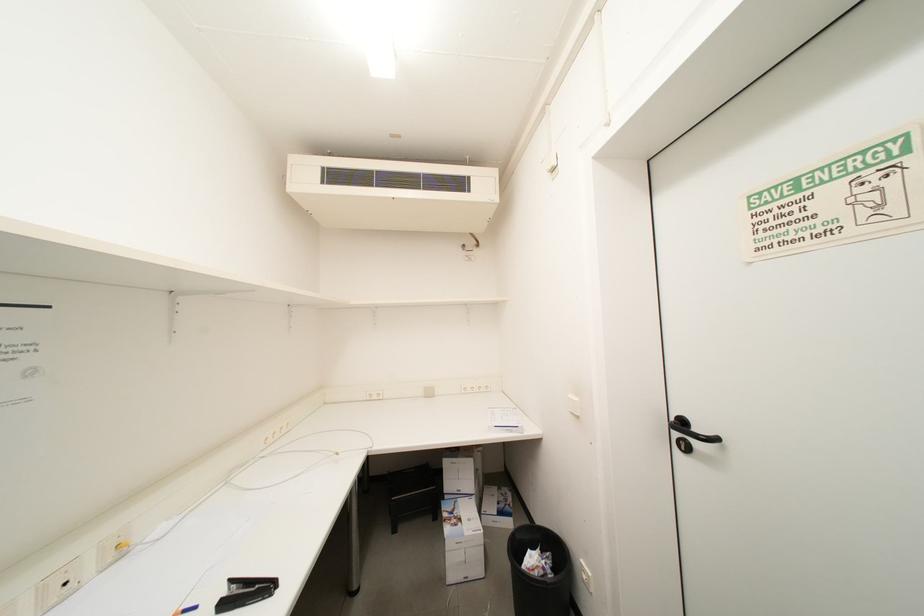
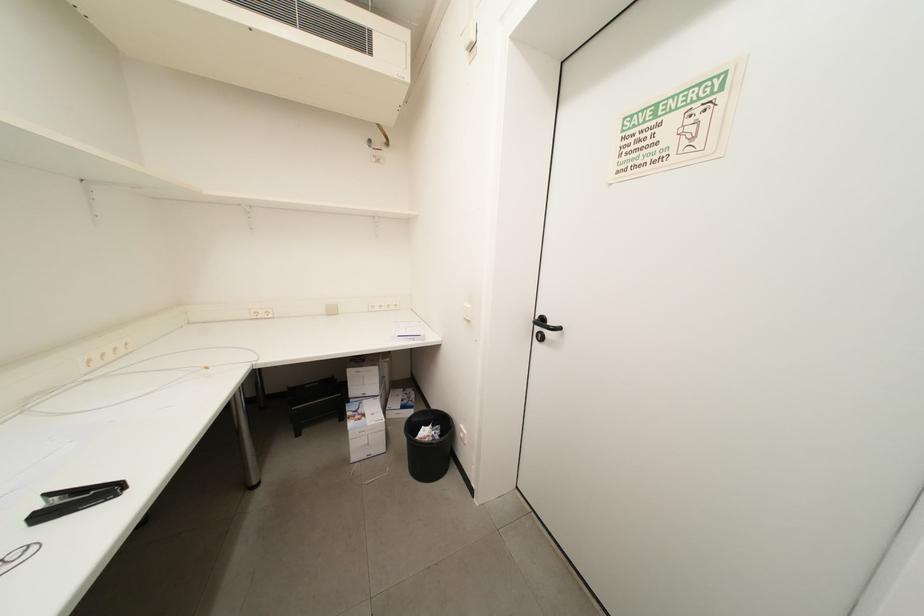
Question: The images are taken continuously from a first-person perspective. In which direction are you moving?

Choices:
 (A) Left
 (B) Right
 (C) Forward
 (D) Backward

Answer: (B)